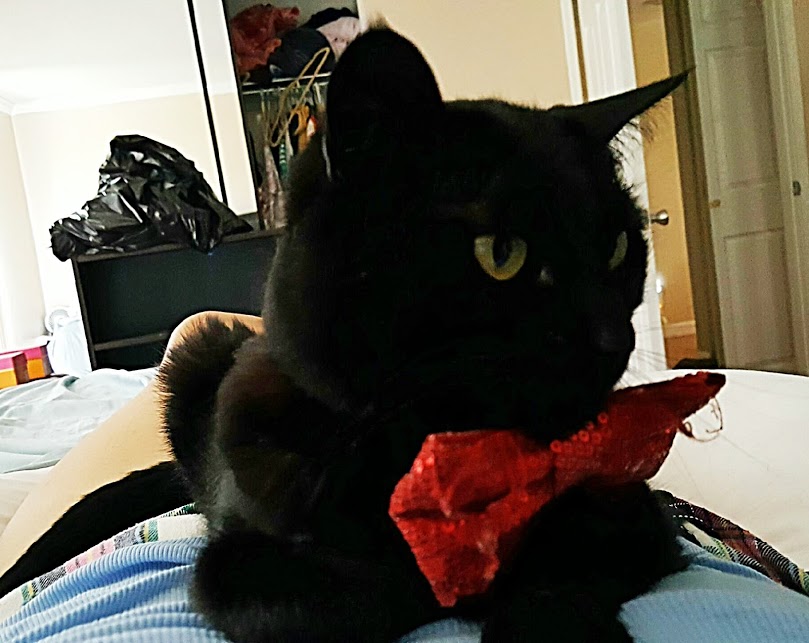
What are the coordinates of `white door` in the screenshot? It's located at (615, 51).